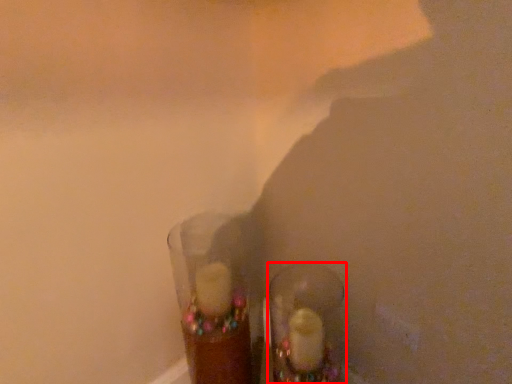
Question: From the image's perspective, considering the relative positions of footwear (annotated by the red box) and shot glass in the image provided, where is footwear (annotated by the red box) located with respect to the staircase?

Choices:
 (A) below
 (B) above

Answer: (A)